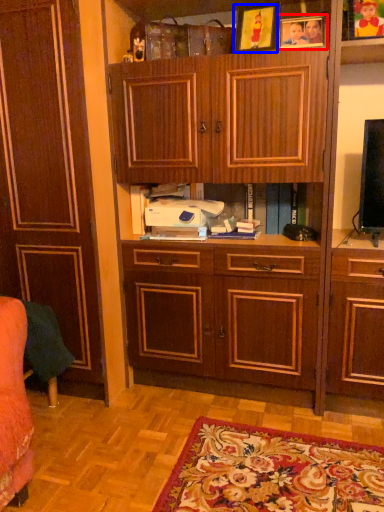
Question: Which object is further to the camera taking this photo, picture frame (highlighted by a red box) or picture frame (highlighted by a blue box)?

Choices:
 (A) picture frame
 (B) picture frame

Answer: (A)